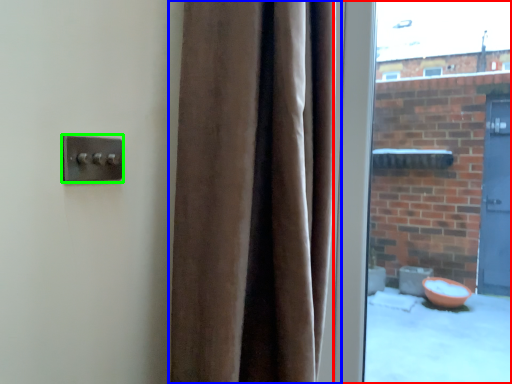
Question: Which is farther away from window (highlighted by a red box)? curtain (highlighted by a blue box) or door handle (highlighted by a green box)?

Choices:
 (A) curtain
 (B) door handle

Answer: (B)